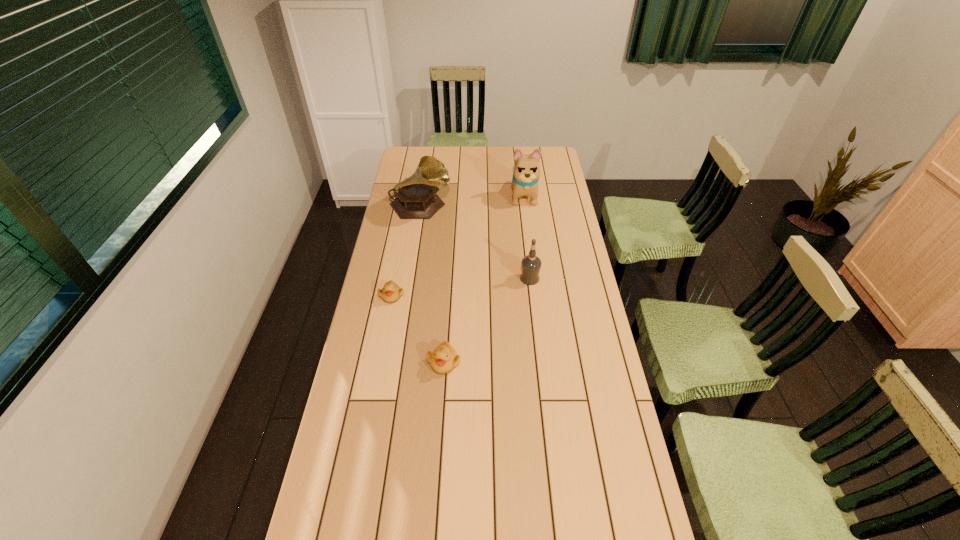
Locate an element on the screen. The height and width of the screenshot is (540, 960). free spot located on the front label of the third tallest object is located at coordinates (487, 279).

Locate an element on the screen. vacant space situated on the front label of the third tallest object is located at coordinates (502, 279).

In order to click on free spot located on the front label of the third tallest object in this screenshot , I will do `click(466, 279)`.

Find the location of a particular element. vacant space located 0.110m on the front-facing side of the nearest object is located at coordinates (441, 408).

Identify the location of free space located 0.230m at the beak of the left duckling. Image resolution: width=960 pixels, height=540 pixels. (x=380, y=357).

The image size is (960, 540). What are the coordinates of `phonograph record that is positioned at the left edge` in the screenshot? It's located at (416, 198).

In order to click on duckling present at the left edge in this screenshot , I will do `click(391, 292)`.

Where is `object that is at the right edge`? This screenshot has width=960, height=540. object that is at the right edge is located at coordinates (526, 173).

In the image, there is a desktop. At what (x,y) coordinates should I click in order to perform the action: click on vacant space at the far edge. Please return your answer as a coordinate pair (x, y). Looking at the image, I should click on (464, 165).

In the image, there is a desktop. Identify the location of free space at the left edge. This screenshot has height=540, width=960. (406, 175).